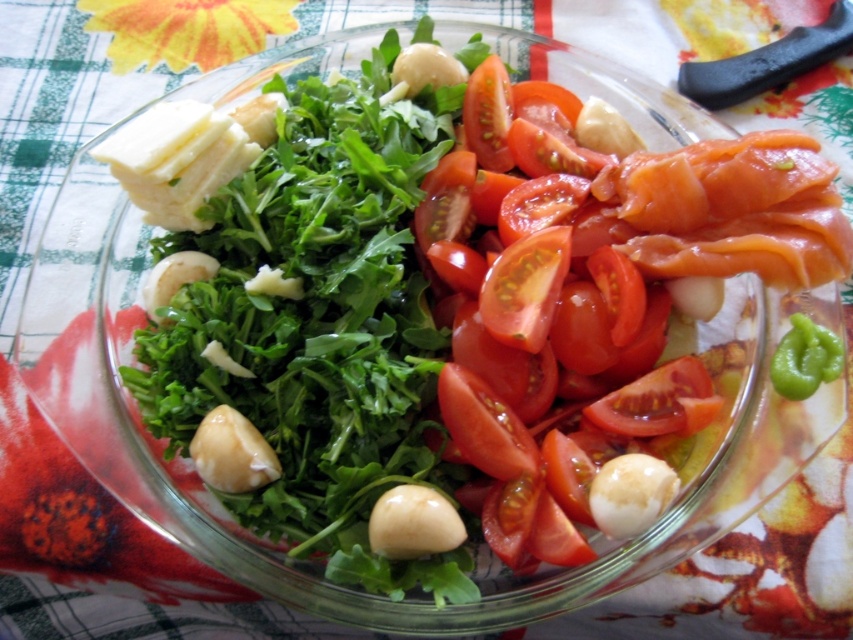
Question: Can you confirm if glossy red tomato at center is positioned above green matte pepper at lower right?

Choices:
 (A) no
 (B) yes

Answer: (B)

Question: Does glossy red tomato at center have a greater width compared to green matte pepper at lower right?

Choices:
 (A) yes
 (B) no

Answer: (A)

Question: Observing the image, what is the correct spatial positioning of glossy red tomato at center in reference to green matte pepper at lower right?

Choices:
 (A) right
 (B) left

Answer: (B)

Question: Among these objects, which one is farthest from the camera?

Choices:
 (A) glossy red tomato at center
 (B) green matte pepper at lower right

Answer: (B)

Question: Which object is closer to the camera taking this photo?

Choices:
 (A) glossy red tomato at center
 (B) green matte pepper at lower right

Answer: (A)